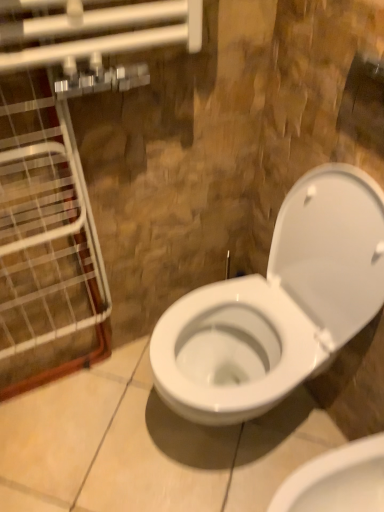
Question: Is white glossy toilet at center, the first toilet ordered from the bottom, wider than white glossy toilet at center, which is the first toilet from top to bottom?

Choices:
 (A) no
 (B) yes

Answer: (A)

Question: Is white glossy toilet at center, the first toilet ordered from the bottom, thinner than white glossy toilet at center, which is the first toilet from top to bottom?

Choices:
 (A) yes
 (B) no

Answer: (A)

Question: From the image's perspective, is white glossy toilet at center, acting as the second toilet starting from the top, below white glossy toilet at center, the second toilet from the bottom?

Choices:
 (A) yes
 (B) no

Answer: (A)

Question: Is white glossy toilet at center, the first toilet ordered from the bottom, smaller than white glossy toilet at center, which is the first toilet from top to bottom?

Choices:
 (A) yes
 (B) no

Answer: (A)

Question: Considering the relative sizes of white glossy toilet at center, the first toilet ordered from the bottom, and white glossy toilet at center, the second toilet from the bottom, in the image provided, is white glossy toilet at center, the first toilet ordered from the bottom, shorter than white glossy toilet at center, the second toilet from the bottom,?

Choices:
 (A) yes
 (B) no

Answer: (A)

Question: From a real-world perspective, is white glossy toilet at center, the first toilet ordered from the bottom, physically located above or below clear glass door at left?

Choices:
 (A) above
 (B) below

Answer: (B)

Question: Is white glossy toilet at center, acting as the second toilet starting from the top, wider or thinner than clear glass door at left?

Choices:
 (A) thin
 (B) wide

Answer: (B)

Question: Is point (299, 488) positioned closer to the camera than point (96, 354)?

Choices:
 (A) farther
 (B) closer

Answer: (B)

Question: Is white glossy toilet at center, the first toilet ordered from the bottom, taller or shorter than clear glass door at left?

Choices:
 (A) short
 (B) tall

Answer: (A)

Question: From a real-world perspective, is white glossy toilet at center, which is the first toilet from top to bottom, physically located above or below white glossy toilet at center, acting as the second toilet starting from the top?

Choices:
 (A) above
 (B) below

Answer: (A)

Question: Considering the positions of white glossy toilet at center, the second toilet from the bottom, and white glossy toilet at center, the first toilet ordered from the bottom, in the image, is white glossy toilet at center, the second toilet from the bottom, wider or thinner than white glossy toilet at center, the first toilet ordered from the bottom,?

Choices:
 (A) wide
 (B) thin

Answer: (A)

Question: Is point (223, 296) closer or farther from the camera than point (299, 471)?

Choices:
 (A) farther
 (B) closer

Answer: (A)

Question: Is white glossy toilet at center, which is the first toilet from top to bottom, in front of or behind white glossy toilet at center, acting as the second toilet starting from the top, in the image?

Choices:
 (A) behind
 (B) front

Answer: (B)

Question: Considering the positions of clear glass door at left and white glossy toilet at center, which is the first toilet from top to bottom, in the image, is clear glass door at left bigger or smaller than white glossy toilet at center, which is the first toilet from top to bottom,?

Choices:
 (A) small
 (B) big

Answer: (A)

Question: Is clear glass door at left inside the boundaries of white glossy toilet at center, which is the first toilet from top to bottom, or outside?

Choices:
 (A) inside
 (B) outside

Answer: (B)